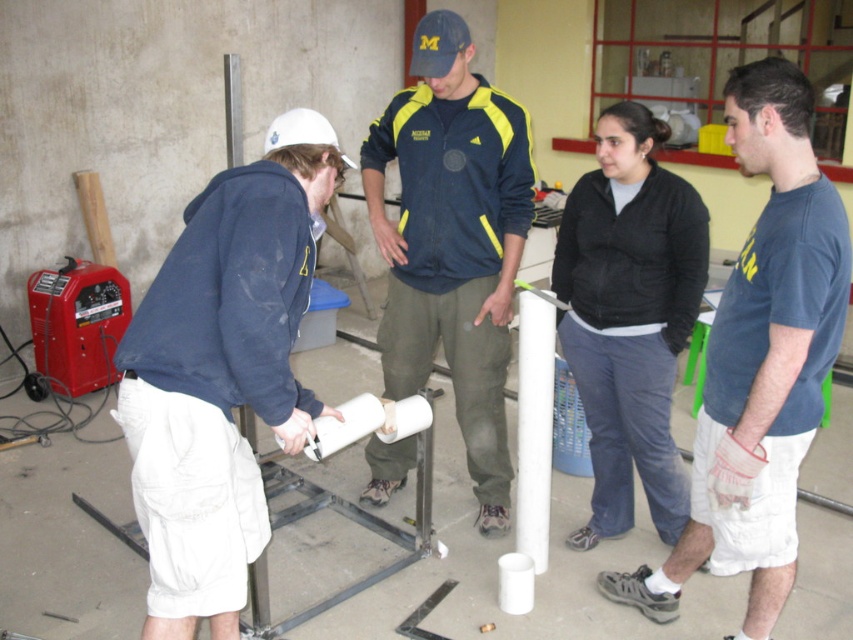
You are organizing a safety equipment check in the workshop. You have to compare the size of the white matte hard hat at left and the black cotton shirt at center. Which one is bigger?

The white matte hard hat at left has a larger size compared to the black cotton shirt at center, so the white matte hard hat at left is bigger.